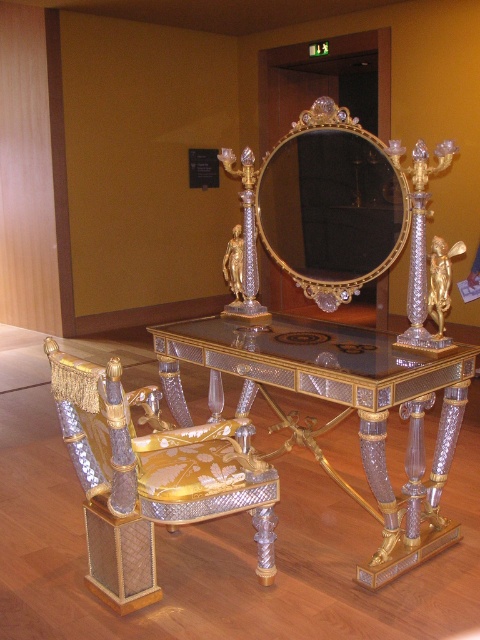
You are standing in front of the ornate vanity set. There is a point marked at coordinates (340, 412). Which object does this point belong to?

The point at coordinates (340, 412) belongs to the gold and glass vanity at center.